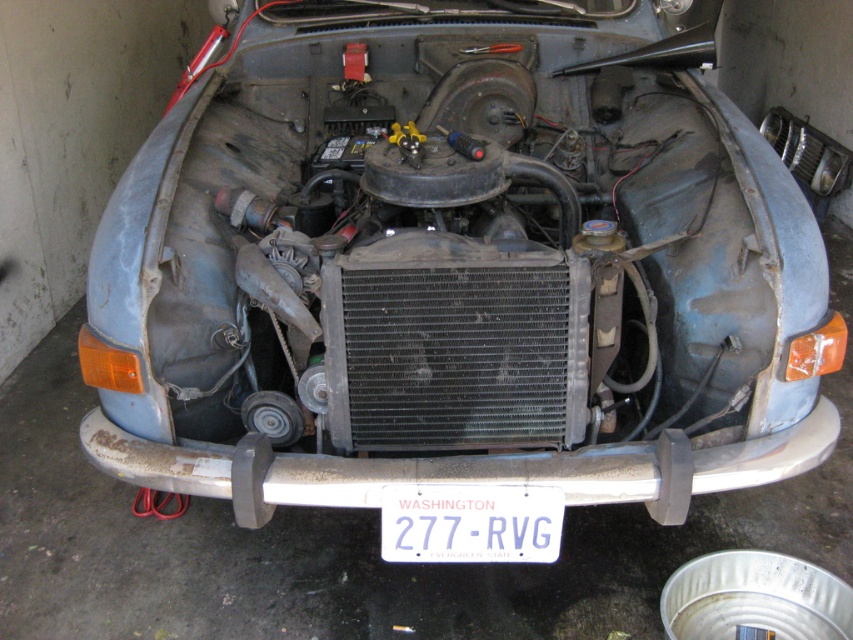
You are a mechanic working on the vintage car. You need to access two points in the engine bay for maintenance. The first point is at coordinate point [312,502] and the second is at point [514,554]. Which point is closer to you as you stand in front of the engine bay?

Point [312,502] is closer to you because it is further to the viewer than point [514,554].

You are a mechanic working on a vintage car. You need to access the license plate to check its registration. Given the layout of the metallic silver bumper at center and the white plastic license plate at center, where would you find the license plate relative to the bumper?

The metallic silver bumper at center is positioned on the left side of the white plastic license plate at center, so the license plate is located to the right of the bumper.

You are a mechanic working on a vintage car. You need to install a new license plate holder that requires 15 centimeters of space between the bumper and the license plate. Can the current spacing between the metallic silver bumper at center and the white plastic license plate at center accommodate this requirement?

The metallic silver bumper at center and the white plastic license plate at center are currently 14.06 centimeters apart, which is less than the required 15 centimeters. Therefore, the current spacing cannot accommodate the new license plate holder.